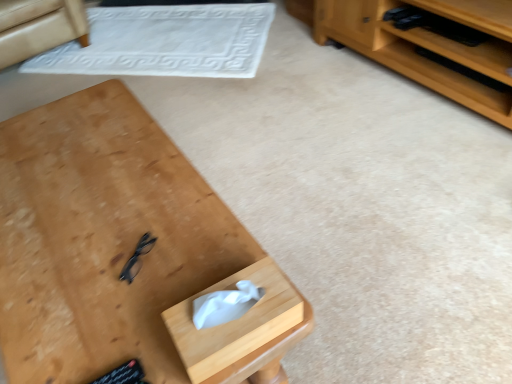
Question: Considering the positions of beige fabric armchair at upper left and wooden tissue box at lower center in the image, is beige fabric armchair at upper left taller or shorter than wooden tissue box at lower center?

Choices:
 (A) short
 (B) tall

Answer: (B)

Question: From the image's perspective, relative to wooden tissue box at lower center, is beige fabric armchair at upper left above or below?

Choices:
 (A) below
 (B) above

Answer: (B)

Question: Considering the real-world distances, which object is farthest from the white textured mat at upper center?

Choices:
 (A) wooden tissue box at lower center
 (B) beige fabric armchair at upper left
 (C) wooden desk at center

Answer: (A)

Question: Which of these objects is positioned closest to the wooden tissue box at lower center?

Choices:
 (A) beige fabric armchair at upper left
 (B) white textured mat at upper center
 (C) wooden desk at center

Answer: (C)